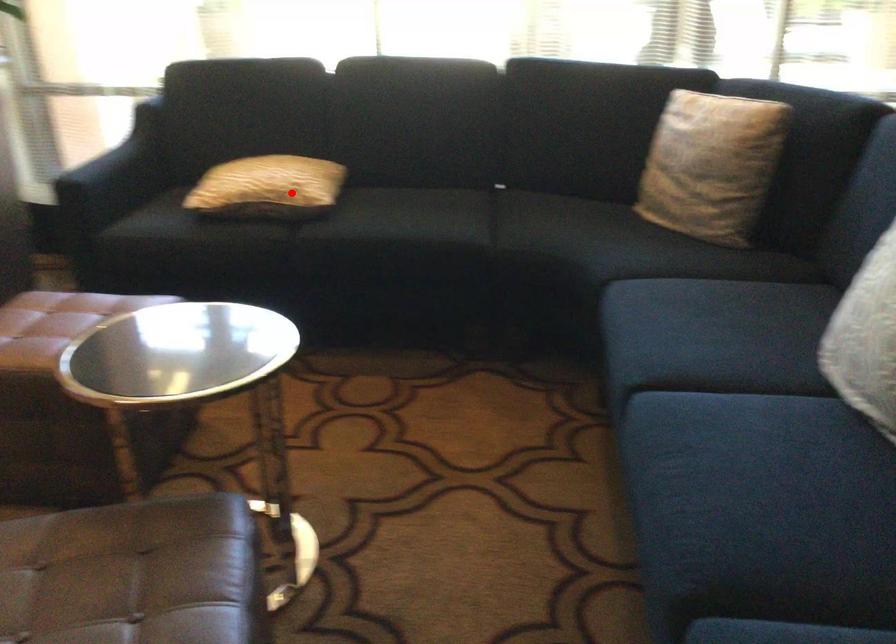
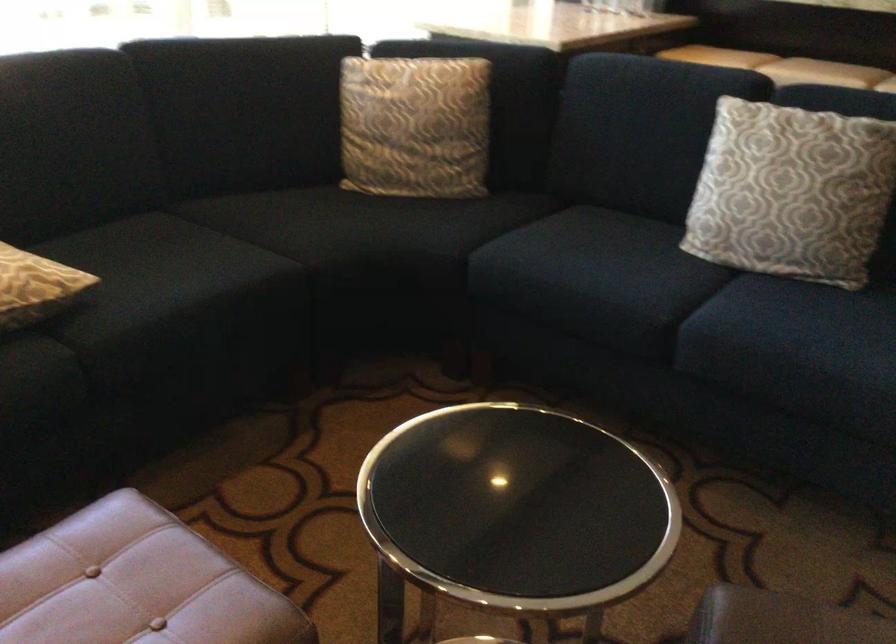
Locate, in the second image, the point that corresponds to the highlighted location in the first image.

(35, 287)